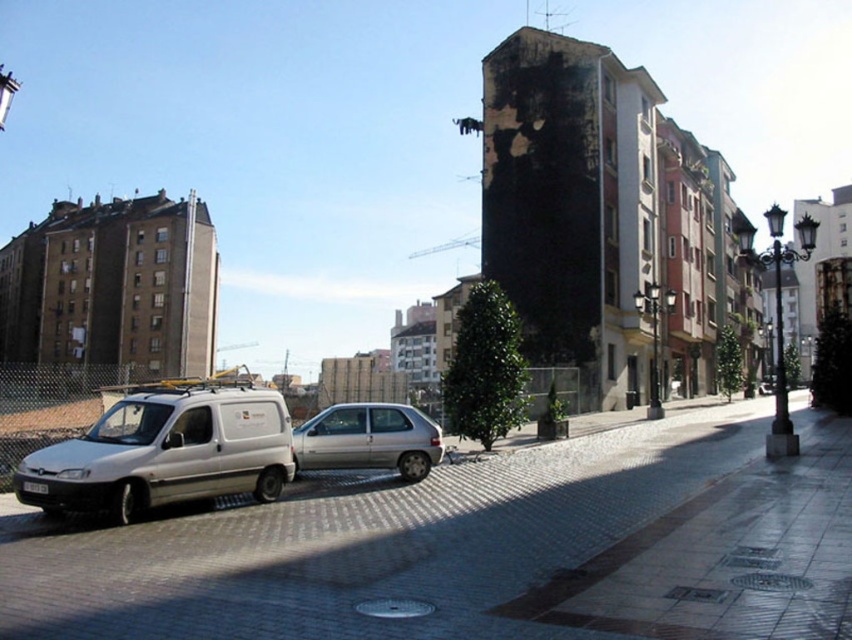
You are a delivery driver who needs to park your truck between the white matte van at left and the silver metallic hatchback at center. Given that your truck is 6 meters long, can you fit it in the space between them?

The white matte van at left is larger in size than the silver metallic hatchback at center, but the exact distance between them isn not provided. Without knowing the space between the two vehicles, it is impossible to determine if the truck can fit.

You are a delivery person trying to park your small truck in this area. The paved stone road at center and the white matte van at left are in your view. Can you tell me which one has more space available for parking?

The paved stone road at center has a larger size compared to the white matte van at left, so there is more space available on the paved stone road at center for parking.

You are standing at the point with coordinates (x=481, y=548) in the urban street scene. What object are you standing on?

You are standing on the paved stone road at center located at point (x=481, y=548).